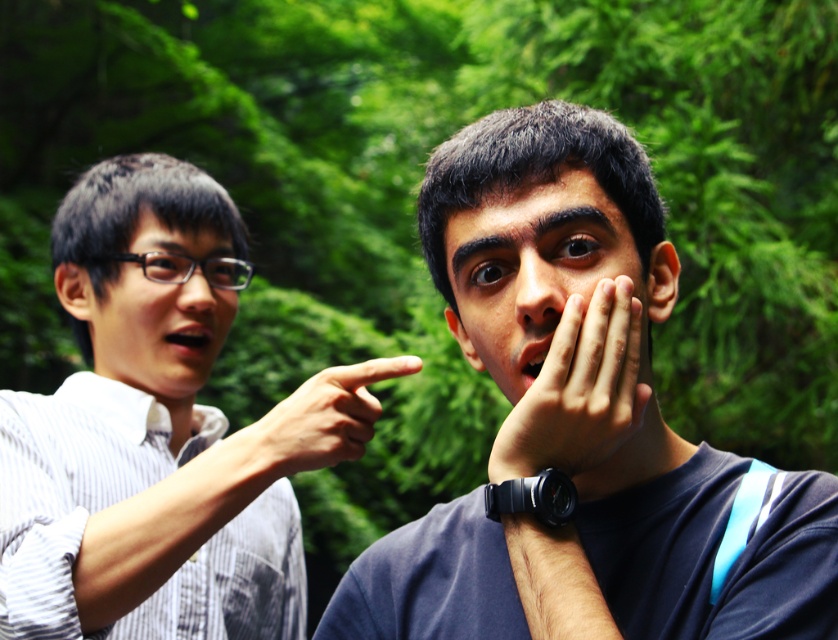
Can you confirm if matte skin finger at center is positioned below matte skin mouth at left?

Correct, matte skin finger at center is located below matte skin mouth at left.

Does matte skin finger at center have a greater width compared to matte skin mouth at left?

Indeed, matte skin finger at center has a greater width compared to matte skin mouth at left.

Which is in front, point (329, 440) or point (205, 346)?

Point (329, 440) is in front.

This screenshot has height=640, width=838. Find the location of `matte skin finger at center`. matte skin finger at center is located at coordinates (319, 420).

Between point (526, 456) and point (199, 352), which one is positioned behind?

Positioned behind is point (199, 352).

Between point (609, 422) and point (161, 348), which one is positioned in front?

Point (609, 422) is more forward.

Identify the location of matte skin hand at center. This screenshot has width=838, height=640. (580, 392).

Is matte skin face at center shorter than matte skin nose at center?

Incorrect, matte skin face at center's height does not fall short of matte skin nose at center's.

Looking at this image, who is more forward, (x=655, y=289) or (x=555, y=288)?

Point (x=555, y=288) is more forward.

The width and height of the screenshot is (838, 640). I want to click on matte skin face at center, so click(549, 282).